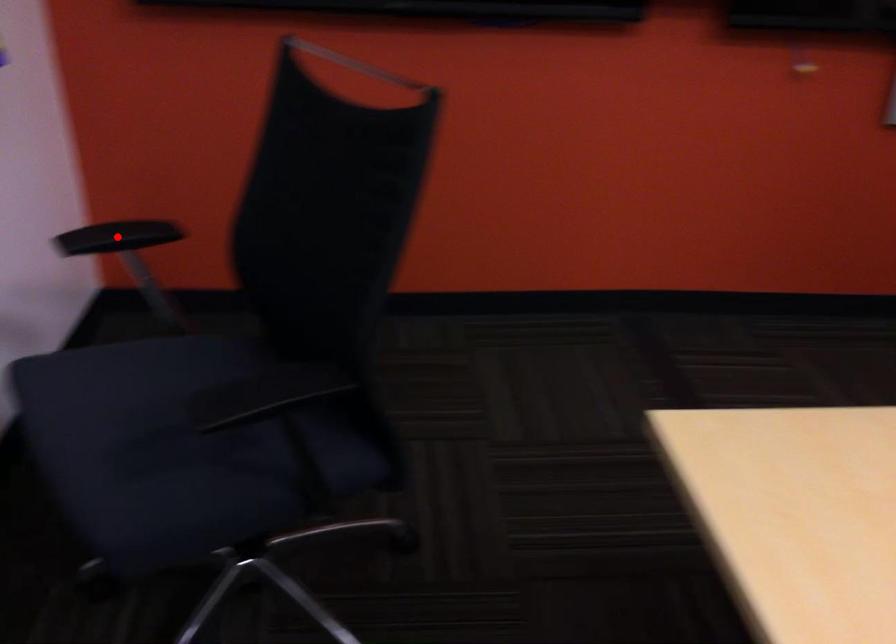
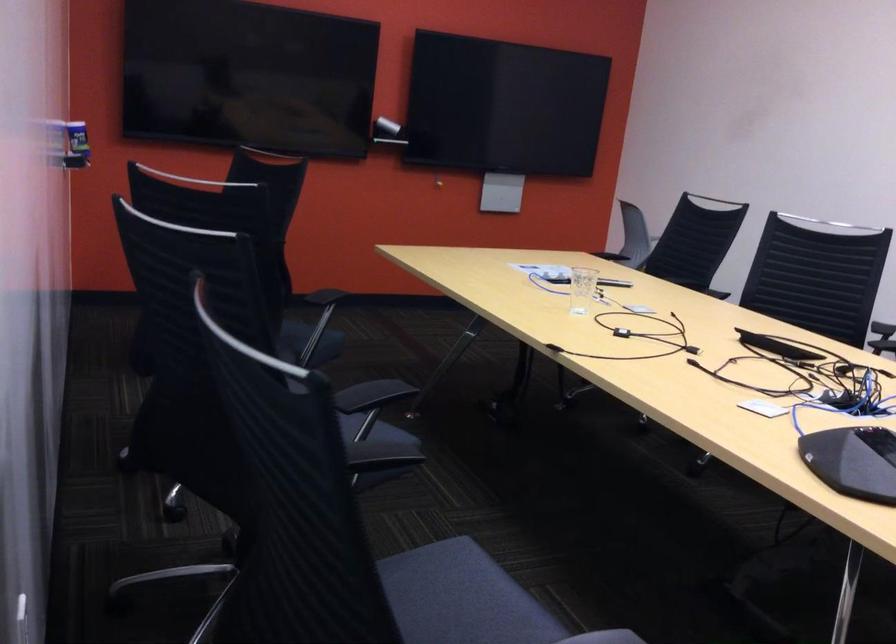
Question: I am providing you with two images of the same scene from different viewpoints. A red point is marked on the first image. At the location where the point appears in image 1, is it still visible in image 2?

Choices:
 (A) Yes
 (B) No

Answer: (B)